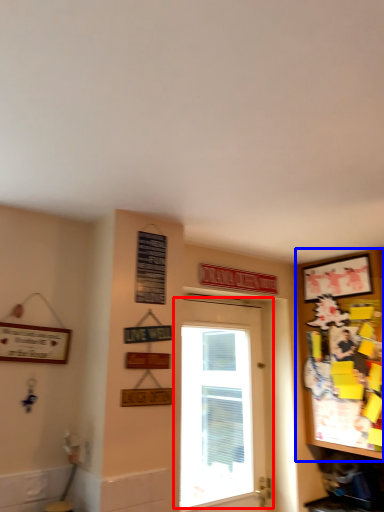
Question: Among these objects, which one is nearest to the camera, door (highlighted by a red box) or cabinetry (highlighted by a blue box)?

Choices:
 (A) door
 (B) cabinetry

Answer: (B)